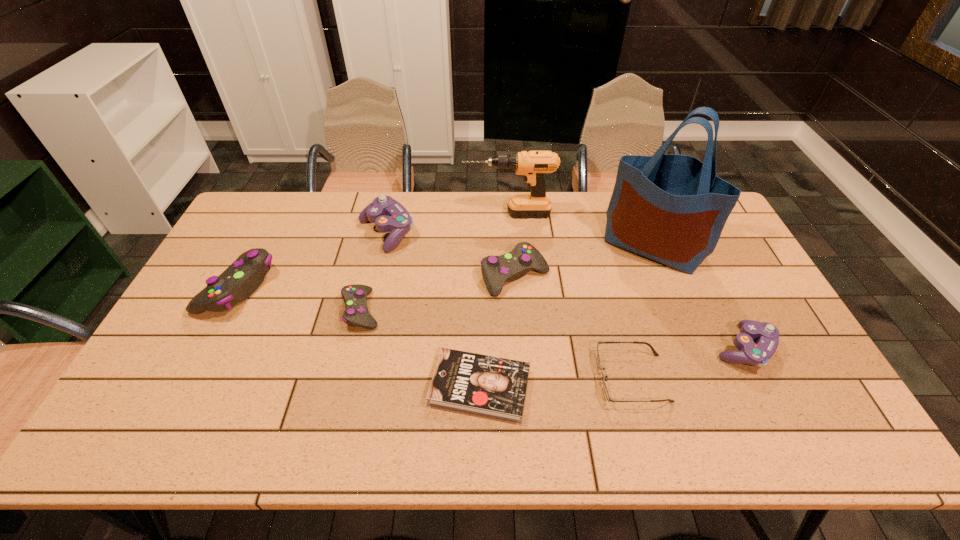
Find the location of a particular element. the right purple control is located at coordinates (756, 354).

Where is `the second gray control from right to left`? Image resolution: width=960 pixels, height=540 pixels. the second gray control from right to left is located at coordinates (356, 314).

Where is `the shortest control`? This screenshot has width=960, height=540. the shortest control is located at coordinates click(356, 314).

You are a GUI agent. You are given a task and a screenshot of the screen. Output one action in this format:
    pyautogui.click(x=<x>, y=<y>)
    Task: Click on the spectacles
    
    Given the screenshot: What is the action you would take?
    pyautogui.click(x=655, y=353)

Where is `book`? book is located at coordinates (494, 387).

Image resolution: width=960 pixels, height=540 pixels. What are the coordinates of `vacant space located 0.100m on the front of the handbag` in the screenshot? It's located at (675, 299).

This screenshot has height=540, width=960. Find the location of `vacant space located at the tip of the drill`. vacant space located at the tip of the drill is located at coordinates (354, 214).

Identify the location of free region located at the tip of the drill. (388, 214).

Image resolution: width=960 pixels, height=540 pixels. I want to click on blank space located 0.050m at the tip of the drill, so click(449, 214).

This screenshot has height=540, width=960. I want to click on free spot located 0.180m on the front of the farther purple control, so click(x=372, y=295).